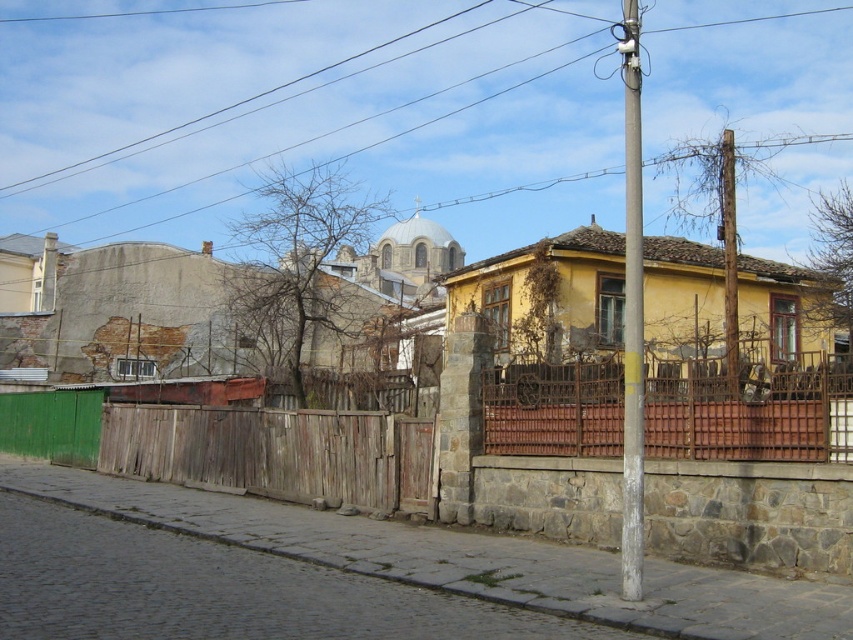
You are a GUI agent. You are given a task and a screenshot of the screen. Output one action in this format:
    pyautogui.click(x=<x>, y=<y>)
    Task: Click on the rusty metal fence at center
    
    Given the screenshot: What is the action you would take?
    pyautogui.click(x=750, y=413)

Does rusty metal fence at center have a larger size compared to wooden pole at right?

Incorrect, rusty metal fence at center is not larger than wooden pole at right.

What do you see at coordinates (750, 413) in the screenshot? I see `rusty metal fence at center` at bounding box center [750, 413].

Where is `rusty metal fence at center`? This screenshot has height=640, width=853. rusty metal fence at center is located at coordinates (750, 413).

Does point (363, 465) come farther from viewer compared to point (724, 188)?

No, it is not.

The width and height of the screenshot is (853, 640). I want to click on weathered wood fence at center, so click(273, 452).

Locate an element on the screen. weathered wood fence at center is located at coordinates (273, 452).

Is point (227, 412) closer to camera compared to point (634, 564)?

No, (227, 412) is behind (634, 564).

Where is `weathered wood fence at center`? This screenshot has width=853, height=640. weathered wood fence at center is located at coordinates tap(273, 452).

Is point (291, 440) closer to camera compared to point (642, 528)?

No, (291, 440) is further to viewer.

You are a GUI agent. You are given a task and a screenshot of the screen. Output one action in this format:
    pyautogui.click(x=<x>, y=<y>)
    Task: Click on the weathered wood fence at center
    Image resolution: width=853 pixels, height=640 pixels.
    Given the screenshot: What is the action you would take?
    pyautogui.click(x=273, y=452)